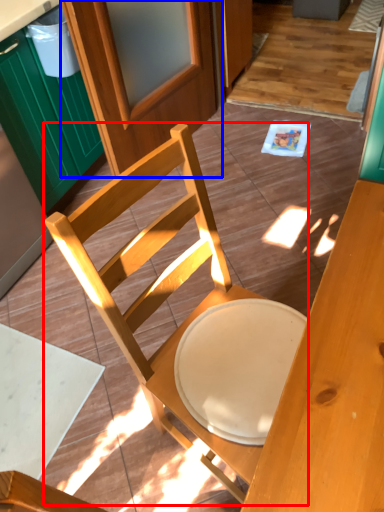
Question: Which object appears farthest to the camera in this image, chair (highlighted by a red box) or screen door (highlighted by a blue box)?

Choices:
 (A) chair
 (B) screen door

Answer: (B)